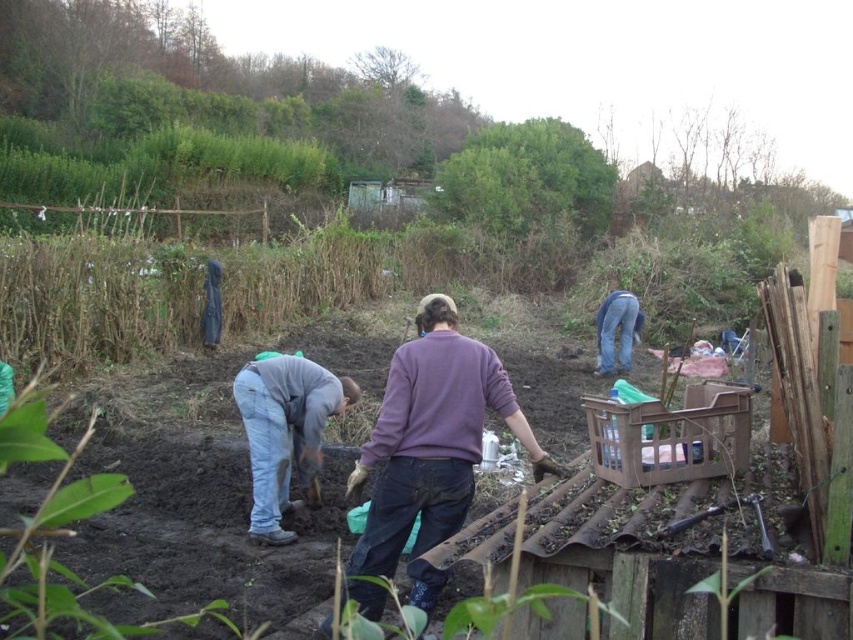
Is purple sweater at center positioned in front of denim jeans at lower left?

Yes, it is in front of denim jeans at lower left.

What do you see at coordinates (431, 445) in the screenshot? I see `purple sweater at center` at bounding box center [431, 445].

Locate an element on the screen. purple sweater at center is located at coordinates (431, 445).

Is purple sweater at center to the right of brown plastic crate at lower right from the viewer's perspective?

Incorrect, purple sweater at center is not on the right side of brown plastic crate at lower right.

Is purple sweater at center to the left of brown plastic crate at lower right from the viewer's perspective?

Yes, purple sweater at center is to the left of brown plastic crate at lower right.

Is point (476, 449) less distant than point (624, 456)?

No, it is behind (624, 456).

Identify the location of purple sweater at center. The image size is (853, 640). (431, 445).

Is purple sweater at center further to the viewer compared to denim jeans at right?

No, it is not.

Which is behind, point (518, 412) or point (630, 307)?

Positioned behind is point (630, 307).

Locate an element on the screen. This screenshot has width=853, height=640. purple sweater at center is located at coordinates (431, 445).